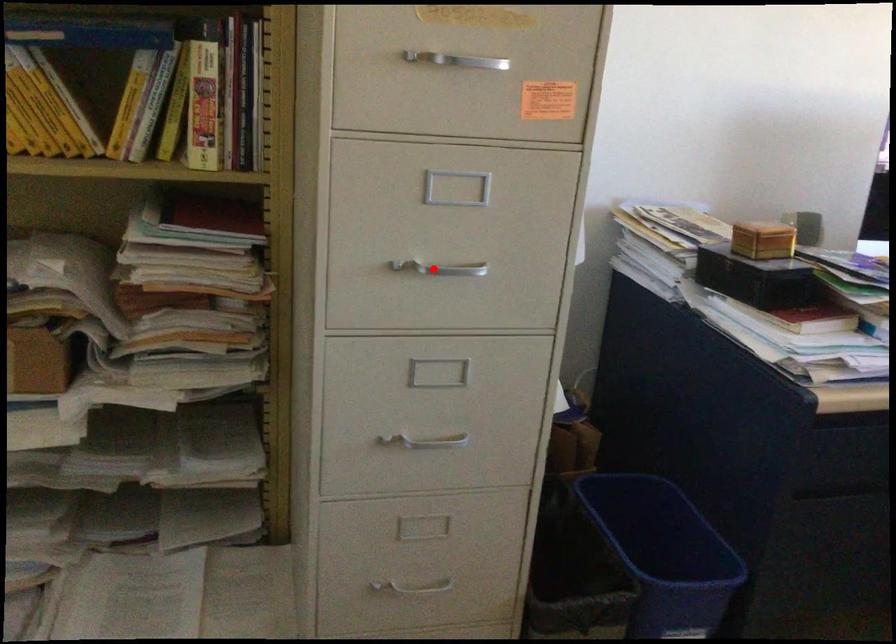
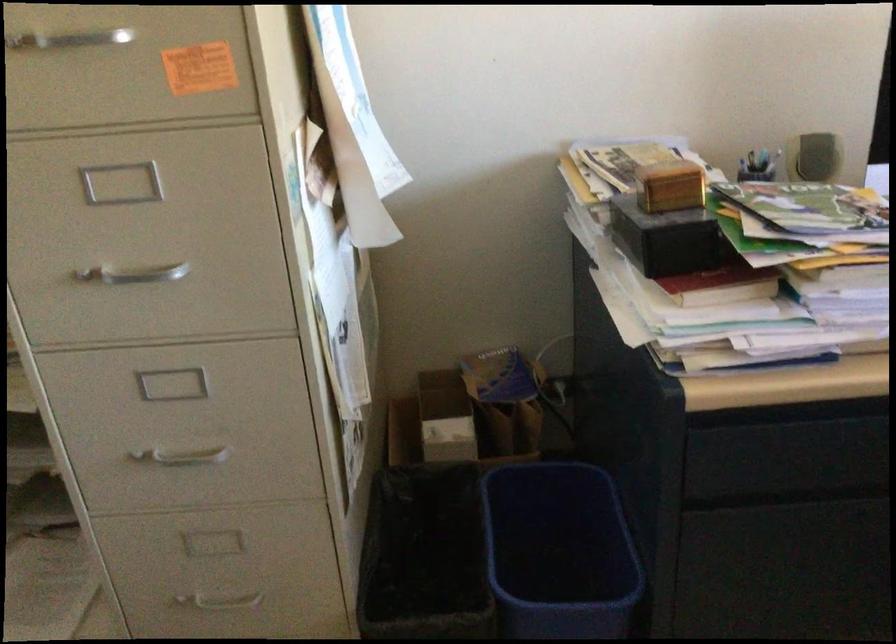
In the second image, find the point that corresponds to the highlighted location in the first image.

(134, 274)